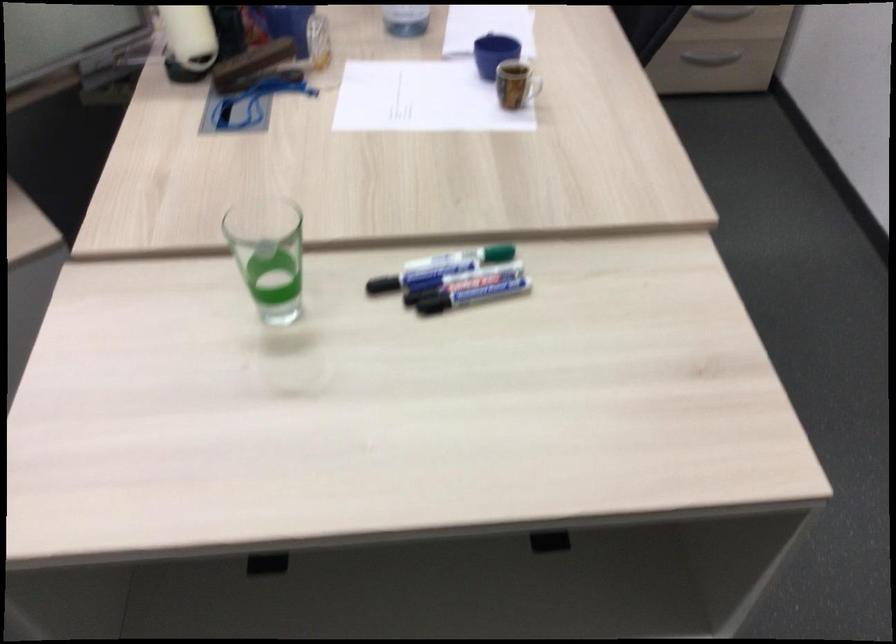
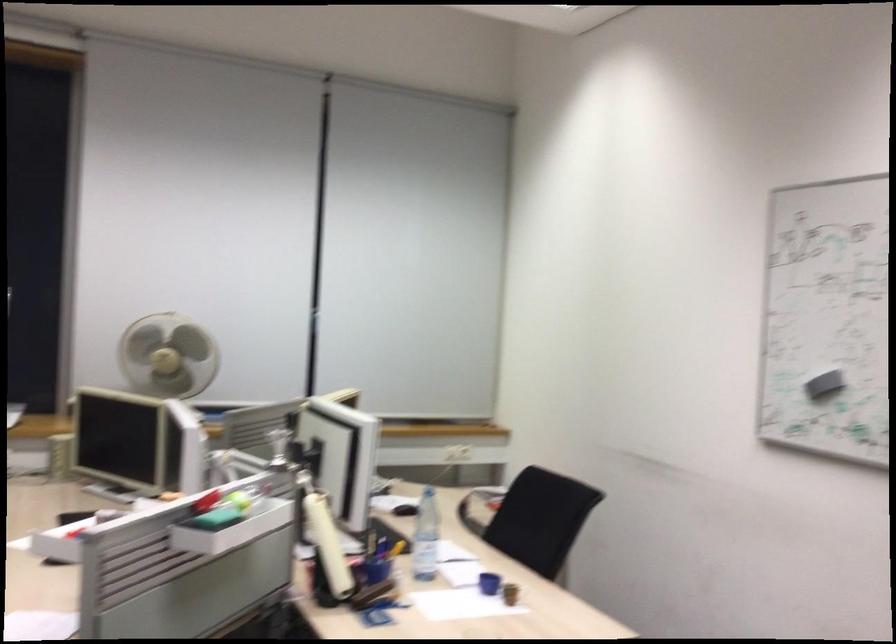
In the second image, find the point that corresponds to pixel 505 100 in the first image.

(510, 592)